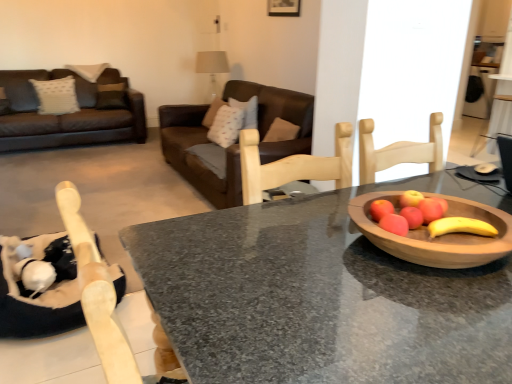
Question: Considering the positions of wooden bowl at right and brown leather couch at center in the image, is wooden bowl at right wider or thinner than brown leather couch at center?

Choices:
 (A) wide
 (B) thin

Answer: (B)

Question: Is wooden bowl at right spatially inside brown leather couch at center, or outside of it?

Choices:
 (A) outside
 (B) inside

Answer: (A)

Question: Which object is positioned closest to the granite table at center?

Choices:
 (A) red matte apple at center
 (B) wooden bowl at right
 (C) brown leather couch at center

Answer: (B)

Question: Based on their relative distances, which object is farther from the granite table at center?

Choices:
 (A) red matte apple at center
 (B) wooden bowl at right
 (C) brown leather couch at center

Answer: (C)